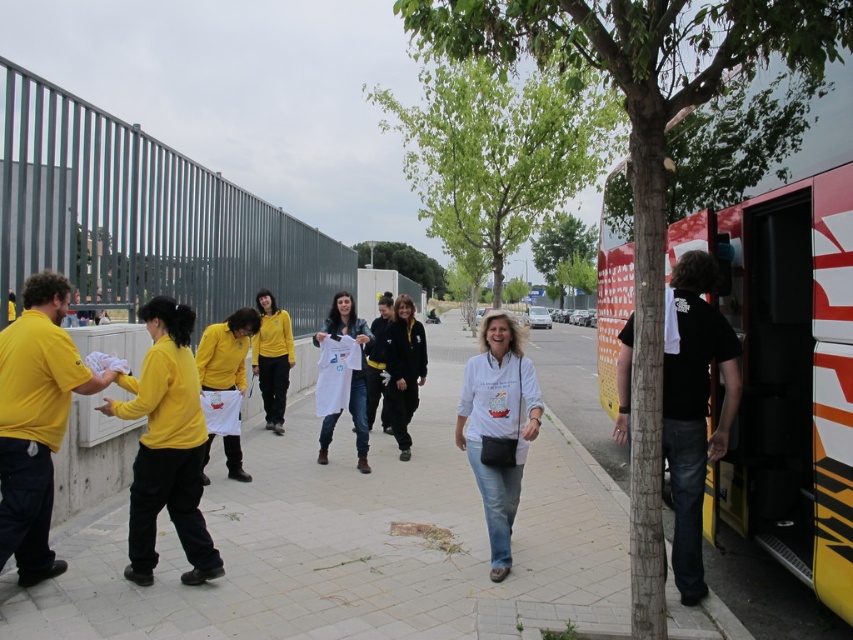
Question: Considering the real-world distances, which object is farthest from the matte yellow shirt at left?

Choices:
 (A) smooth concrete pavement at center
 (B) matte yellow shirt at center
 (C) white matte t-shirt at center
 (D) matte yellow sweatshirt at center

Answer: (D)

Question: Is matte yellow shirt at left positioned behind white matte t-shirt at center?

Choices:
 (A) no
 (B) yes

Answer: (A)

Question: Is smooth concrete pavement at center behind yellow and red painted bus at right?

Choices:
 (A) no
 (B) yes

Answer: (B)

Question: Can you confirm if smooth concrete pavement at center is smaller than matte yellow sweatshirt at center?

Choices:
 (A) yes
 (B) no

Answer: (B)

Question: Which point is farther to the camera?

Choices:
 (A) (119, 406)
 (B) (225, 337)

Answer: (B)

Question: Which object appears closest to the camera in this image?

Choices:
 (A) matte yellow sweatshirt at center
 (B) white matte shirt at center

Answer: (B)